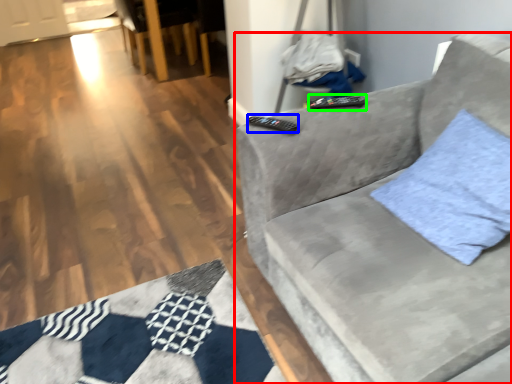
Question: Estimate the real-world distances between objects in this image. Which object is closer to studio couch (highlighted by a red box), remote (highlighted by a blue box) or remote (highlighted by a green box)?

Choices:
 (A) remote
 (B) remote

Answer: (B)